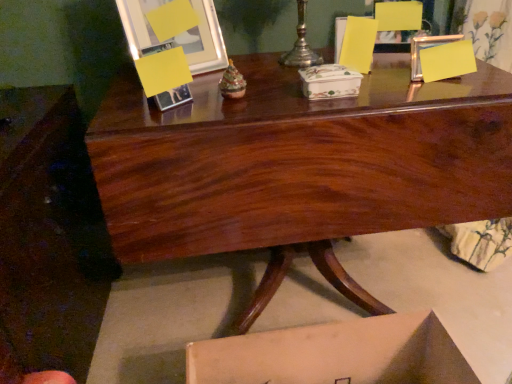
Locate an element on the screen. vacant space underneath glossy wood desk at center (from a real-world perspective) is located at coordinates (288, 285).